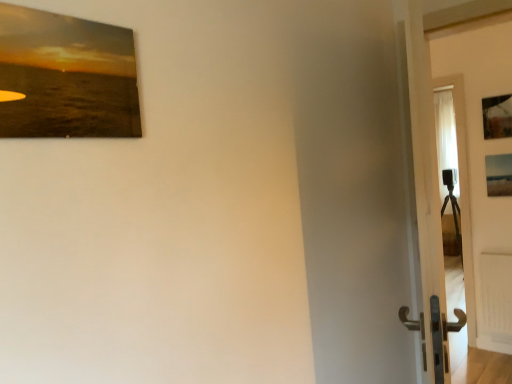
Question: Considering the relative sizes of wooden frame at upper right, which ranks as the 3th picture frame in bottom-to-top order, and white glossy door at right in the image provided, is wooden frame at upper right, which ranks as the 3th picture frame in bottom-to-top order, smaller than white glossy door at right?

Choices:
 (A) no
 (B) yes

Answer: (B)

Question: Is wooden frame at upper right, which is counted as the 2th picture frame, starting from the left, bigger than white glossy door at right?

Choices:
 (A) yes
 (B) no

Answer: (B)

Question: Is wooden frame at upper right, which is counted as the 2th picture frame, starting from the left, thinner than white glossy door at right?

Choices:
 (A) no
 (B) yes

Answer: (B)

Question: Is wooden frame at upper right, which is the first picture frame in top-to-bottom order, beside white glossy door at right?

Choices:
 (A) yes
 (B) no

Answer: (B)

Question: Is wooden frame at upper right, which is counted as the 2th picture frame, starting from the left, oriented towards white glossy door at right?

Choices:
 (A) no
 (B) yes

Answer: (B)

Question: Is matte wooden picture frame at upper left, the 2th picture frame in the top-to-bottom sequence, in front of or behind wooden frame at upper right, which is the first picture frame in top-to-bottom order, in the image?

Choices:
 (A) front
 (B) behind

Answer: (A)

Question: Is point (122, 114) positioned closer to the camera than point (489, 130)?

Choices:
 (A) closer
 (B) farther

Answer: (A)

Question: Based on their positions, is matte wooden picture frame at upper left, positioned as the third picture frame in back-to-front order, located to the left or right of wooden frame at upper right, which is counted as the 2th picture frame, starting from the left?

Choices:
 (A) right
 (B) left

Answer: (B)

Question: From a real-world perspective, is matte wooden picture frame at upper left, which is the 1th picture frame from front to back, positioned above or below wooden frame at upper right, which ranks as the 3th picture frame in bottom-to-top order?

Choices:
 (A) above
 (B) below

Answer: (B)

Question: Relative to white glossy door at right, is matte wooden picture frame at right, positioned as the 1th picture frame in back-to-front order, in front or behind?

Choices:
 (A) behind
 (B) front

Answer: (A)

Question: Is matte wooden picture frame at right, positioned as the third picture frame in front-to-back order, inside or outside of white glossy door at right?

Choices:
 (A) inside
 (B) outside

Answer: (B)

Question: Is matte wooden picture frame at right, the 3th picture frame in the left-to-right sequence, taller or shorter than white glossy door at right?

Choices:
 (A) tall
 (B) short

Answer: (B)

Question: From the image's perspective, is matte wooden picture frame at right, positioned as the 1th picture frame in back-to-front order, positioned above or below white glossy door at right?

Choices:
 (A) above
 (B) below

Answer: (A)

Question: Considering the positions of point (482, 120) and point (500, 258), is point (482, 120) closer or farther from the camera than point (500, 258)?

Choices:
 (A) closer
 (B) farther

Answer: (A)

Question: Is wooden frame at upper right, which appears as the 2th picture frame when viewed from the back, taller or shorter than white matte radiator at lower right?

Choices:
 (A) short
 (B) tall

Answer: (A)